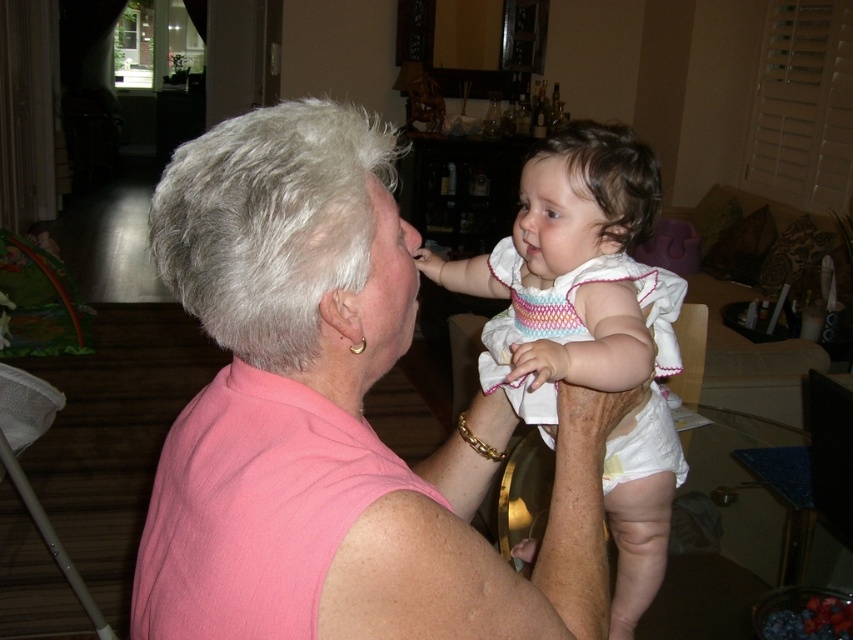
Question: Does pink fabric at center have a larger size compared to white knit dress at center?

Choices:
 (A) yes
 (B) no

Answer: (A)

Question: Which point is farther to the camera?

Choices:
 (A) (578, 308)
 (B) (572, 429)

Answer: (A)

Question: Can you confirm if pink fabric at center is thinner than white knit dress at center?

Choices:
 (A) yes
 (B) no

Answer: (B)

Question: Can you confirm if pink fabric at center is positioned to the left of white knit dress at center?

Choices:
 (A) yes
 (B) no

Answer: (A)

Question: Among these objects, which one is nearest to the camera?

Choices:
 (A) pink fabric at center
 (B) white knit dress at center

Answer: (A)

Question: Which point is farther to the camera?

Choices:
 (A) (172, 634)
 (B) (631, 522)

Answer: (B)